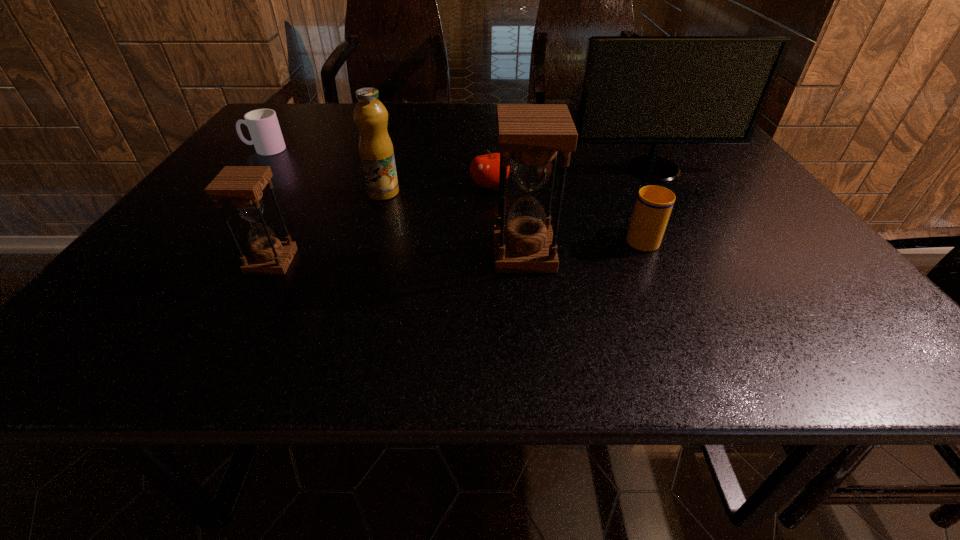
Locate an element on the screen. The image size is (960, 540). vacant space that's between the apple and the computer monitor is located at coordinates (571, 178).

Identify the location of free point between the right cup and the shorter hourglass. The width and height of the screenshot is (960, 540). (456, 249).

I want to click on unoccupied area between the taller hourglass and the fruit juice, so click(x=453, y=223).

The width and height of the screenshot is (960, 540). I want to click on vacant area between the second object from left to right and the left cup, so click(x=268, y=206).

The image size is (960, 540). In order to click on object identified as the fourth closest to the right cup in this screenshot , I will do coord(376,151).

At what (x,y) coordinates should I click in order to perform the action: click on object that is the fourth closest to the left hourglass. Please return your answer as a coordinate pair (x, y). The height and width of the screenshot is (540, 960). Looking at the image, I should click on (263, 125).

Identify the location of vacant space that satisfies the following two spatial constraints: 1. on the side of the nearer cup with the handle; 2. on the front label of the fruit juice. The image size is (960, 540). (620, 193).